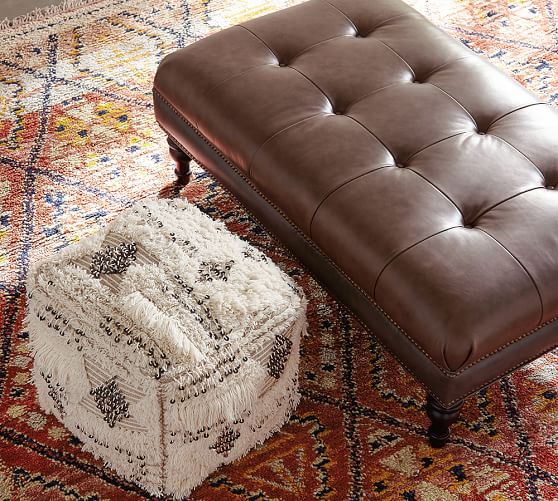
In order to click on rug in this screenshot , I will do `click(112, 113)`.